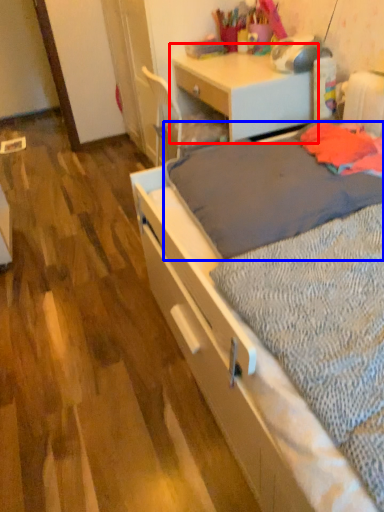
Question: Which object appears farthest to the camera in this image, desk (highlighted by a red box) or blanket (highlighted by a blue box)?

Choices:
 (A) desk
 (B) blanket

Answer: (A)